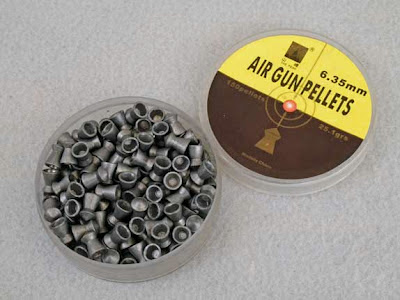
I want to click on gray counter top, so click(x=246, y=251).